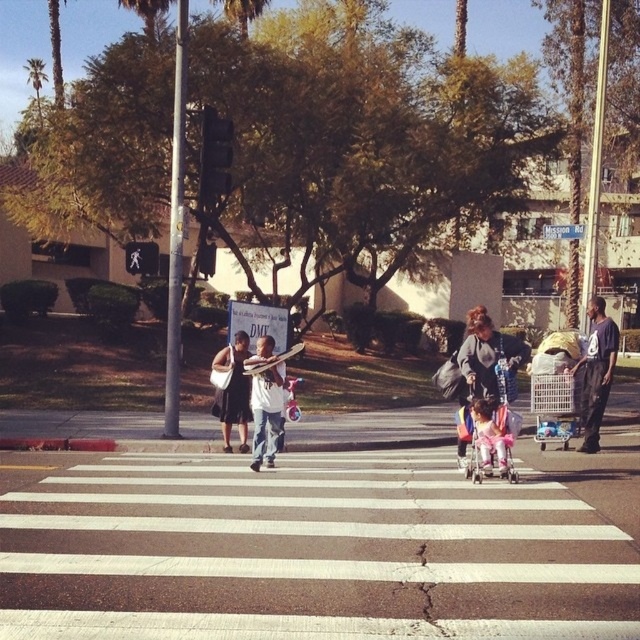
Question: Does white asphalt crosswalk at center appear under white cotton shirt at center?

Choices:
 (A) yes
 (B) no

Answer: (A)

Question: Is white cotton shirt at center bigger than green leafy palm tree at upper left?

Choices:
 (A) no
 (B) yes

Answer: (A)

Question: Which object appears farthest from the camera in this image?

Choices:
 (A) white cotton shirt at center
 (B) dark blue t-shirt at center

Answer: (B)

Question: Does pink fabric baby carriage at center appear on the left side of green leafy palm tree at upper left?

Choices:
 (A) yes
 (B) no

Answer: (B)

Question: Which point is farther to the camera?

Choices:
 (A) (592, 410)
 (B) (173, 577)
 (C) (284, 385)

Answer: (A)

Question: Which object is positioned farthest from the matte pink stroller at center?

Choices:
 (A) pink fabric baby carriage at center
 (B) dark gray dress at center

Answer: (B)